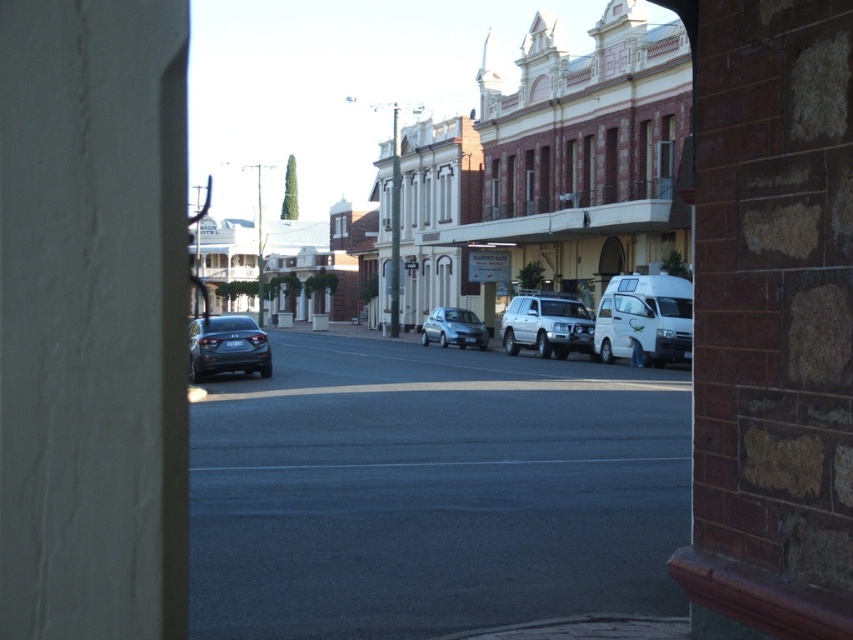
Question: Which object is closer to the camera taking this photo?

Choices:
 (A) satin silver car at center
 (B) satin black car at center
 (C) matte white building at center

Answer: (B)

Question: Which point appears closest to the camera in this image?

Choices:
 (A) (416, 179)
 (B) (444, 346)

Answer: (B)

Question: Which of the following is the closest to the observer?

Choices:
 (A) (450, 321)
 (B) (550, 445)
 (C) (201, 358)
 (D) (546, 339)

Answer: (B)

Question: Is satin black car at center thinner than satin silver suv at center?

Choices:
 (A) no
 (B) yes

Answer: (A)

Question: Does satin black sedan at center have a larger size compared to satin silver car at center?

Choices:
 (A) yes
 (B) no

Answer: (A)

Question: Does white matte van at center appear on the left side of satin silver suv at center?

Choices:
 (A) yes
 (B) no

Answer: (B)